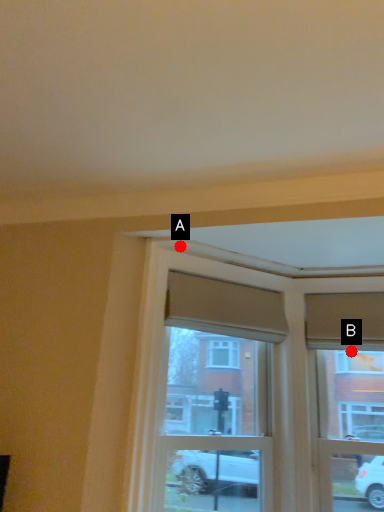
Question: Two points are circled on the image, labeled by A and B beside each circle. Which of the following is the farthest from the observer?

Choices:
 (A) A is further
 (B) B is further

Answer: (B)